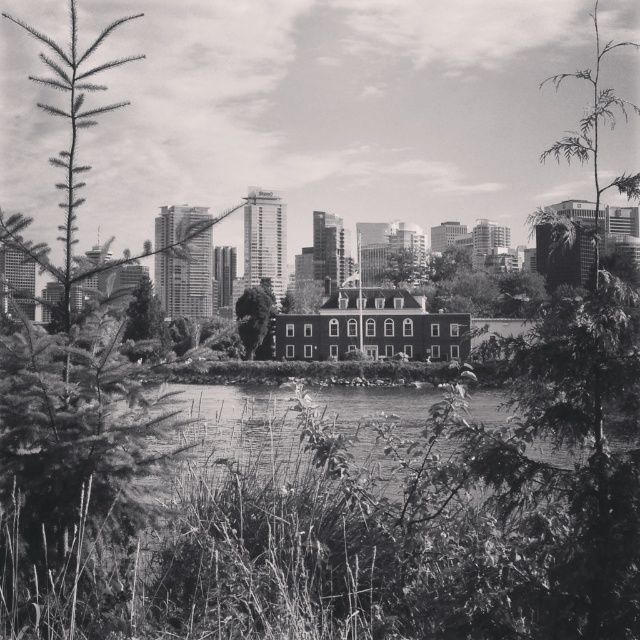
Question: Which point is closer to the camera?

Choices:
 (A) (394, 269)
 (B) (248, 324)

Answer: (B)

Question: Can you confirm if smooth green tree at center is smaller than green leafy tree at center?

Choices:
 (A) yes
 (B) no

Answer: (B)

Question: Among these objects, which one is nearest to the camera?

Choices:
 (A) smooth green tree at center
 (B) green leafy tree at center

Answer: (A)

Question: Is smooth green tree at center to the right of green leafy tree at center from the viewer's perspective?

Choices:
 (A) no
 (B) yes

Answer: (A)

Question: Is smooth green tree at center closer to camera compared to green leafy tree at center?

Choices:
 (A) yes
 (B) no

Answer: (A)